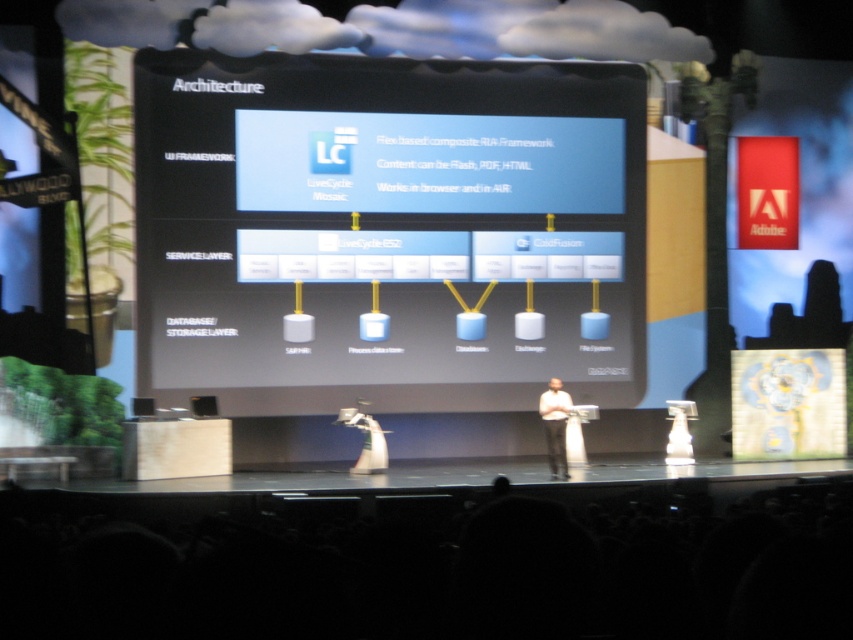
In order to click on white shirt at center in this screenshot , I will do `click(555, 426)`.

Is white shirt at center thinner than white fabric dress at center?

Indeed, white shirt at center has a lesser width compared to white fabric dress at center.

The height and width of the screenshot is (640, 853). Identify the location of white shirt at center. (555, 426).

Is black plastic speaker at lower left bigger than matte black speaker at center?

Indeed, black plastic speaker at lower left has a larger size compared to matte black speaker at center.

Locate an element on the screen. black plastic speaker at lower left is located at coordinates (202, 404).

Between point (209, 403) and point (132, 401), which one is positioned in front?

Positioned in front is point (132, 401).

Where is `black plastic speaker at lower left`? The height and width of the screenshot is (640, 853). black plastic speaker at lower left is located at coordinates (202, 404).

Does white shirt at center have a lesser height compared to matte black speaker at center?

No.

The image size is (853, 640). I want to click on white shirt at center, so click(555, 426).

Between point (554, 404) and point (152, 412), which one is positioned behind?

The point (554, 404) is more distant.

Locate an element on the screen. white shirt at center is located at coordinates (555, 426).